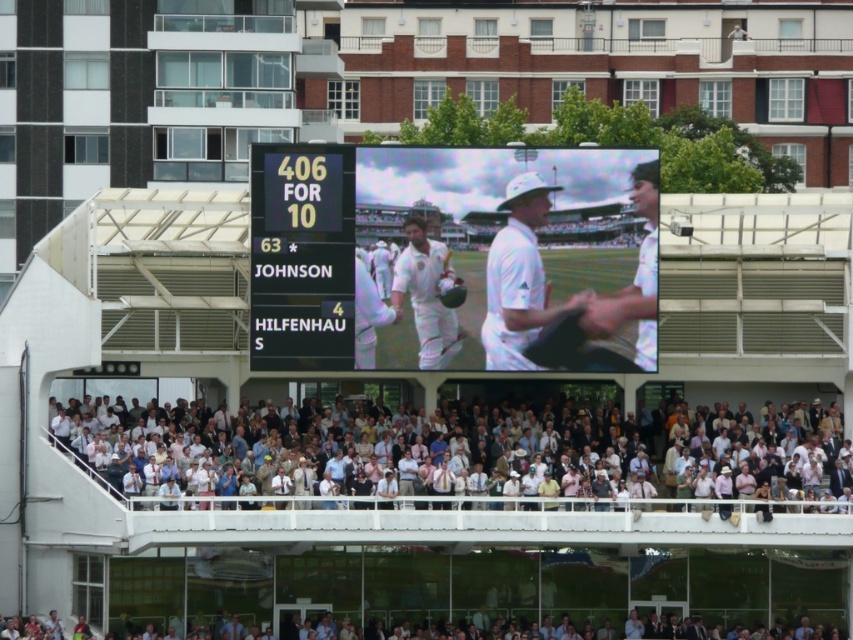
You are a photographer positioned at point (520, 461). You want to capture a photo of the white cotton crowd at lower center. Is the white cotton crowd at lower center visible from your current position?

The white cotton crowd at lower center is located at point (520, 461), so yes, the photographer is already positioned there and can capture the photo.

You are a photographer positioned at the origin point of the image coordinate system. You want to capture a photo of the yellow digital scoreboard at center. What are the coordinates where you should aim your camera?

The yellow digital scoreboard at center is located at coordinates point (300, 257), so you should aim your camera at those coordinates to capture it.

You are a photographer at the cricket stadium and want to capture both the yellow digital scoreboard at center and the white matte cricket helmet at center in a single photo. Which object should you focus on first to ensure both are in frame?

The yellow digital scoreboard at center has a lesser height compared to the white matte cricket helmet at center, so you should focus on the taller white matte cricket helmet at center first to ensure both are in frame.